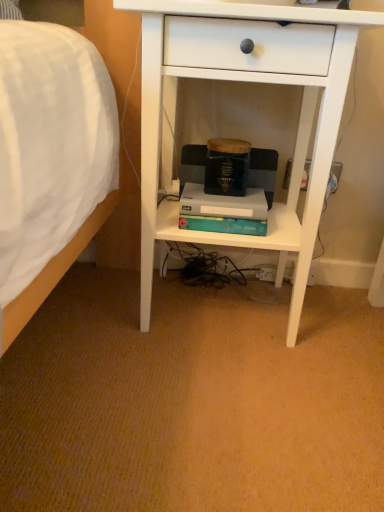
This screenshot has width=384, height=512. I want to click on vacant space to the right of white matte desk at center, so coord(342,326).